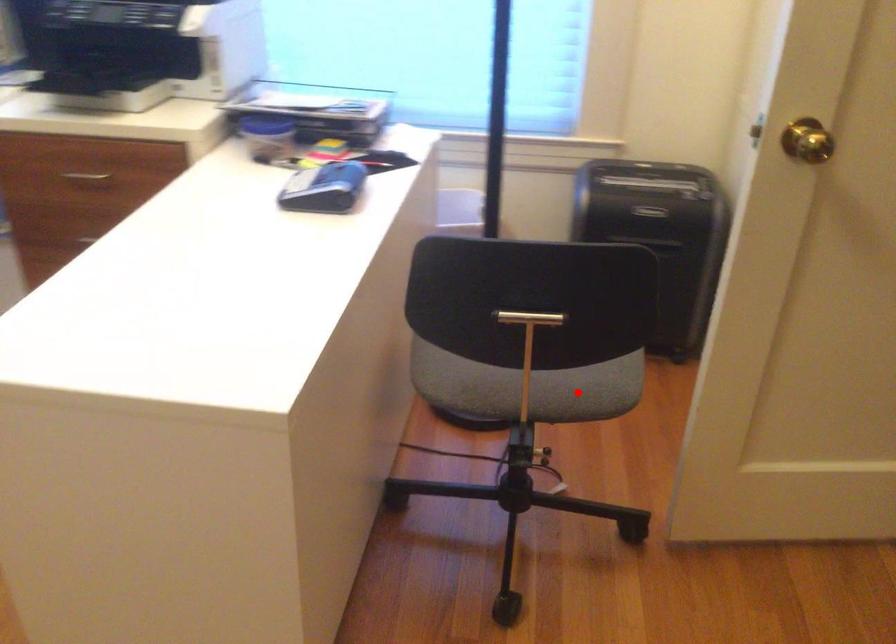
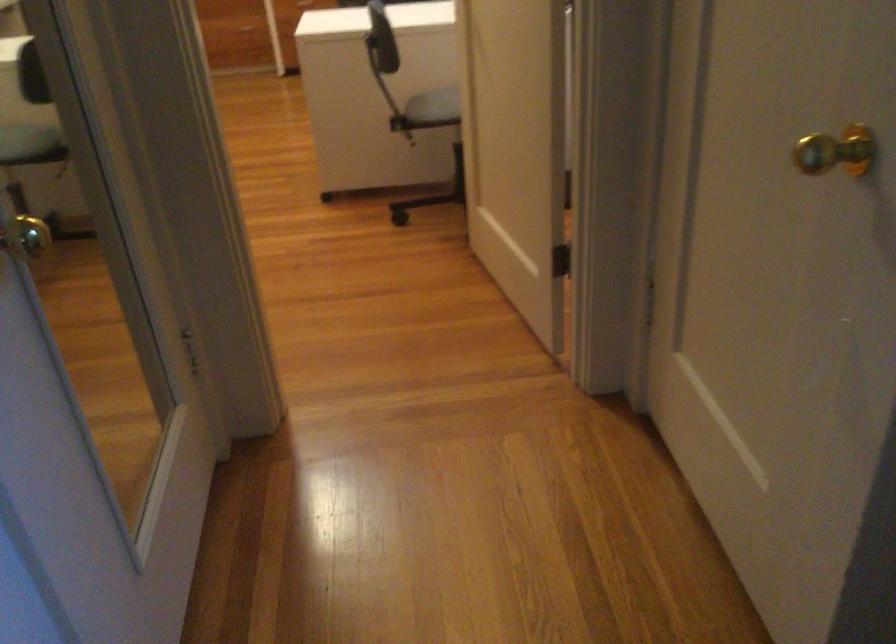
Where in the second image is the point corresponding to the highlighted location from the first image?

(434, 106)